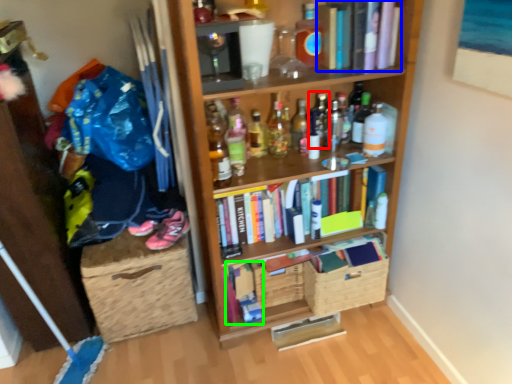
Question: Which object is positioned farthest from bottle (highlighted by a red box)? Select from book (highlighted by a blue box) and book (highlighted by a green box).

Choices:
 (A) book
 (B) book

Answer: (B)